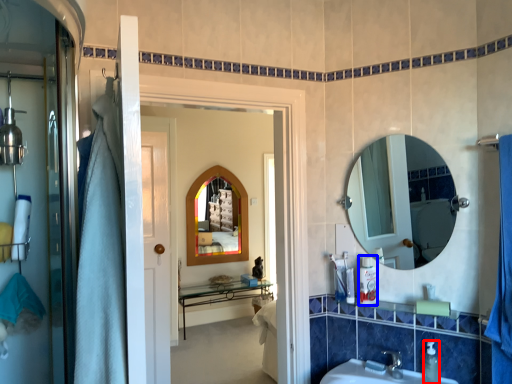
Question: Which of the following is the farthest to the observer, toiletry (highlighted by a red box) or toiletry (highlighted by a blue box)?

Choices:
 (A) toiletry
 (B) toiletry

Answer: (B)